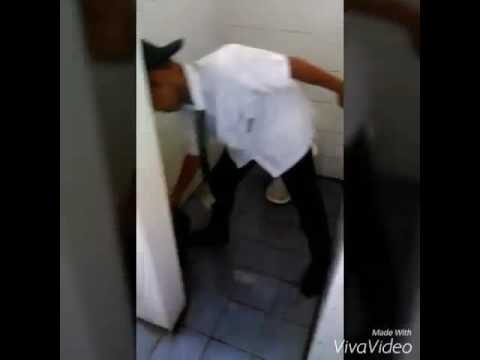
You are a GUI agent. You are given a task and a screenshot of the screen. Output one action in this format:
    pyautogui.click(x=<x>, y=<y>)
    Task: Click on the floor
    The image size is (480, 360).
    Given the screenshot: What is the action you would take?
    pyautogui.click(x=252, y=319)